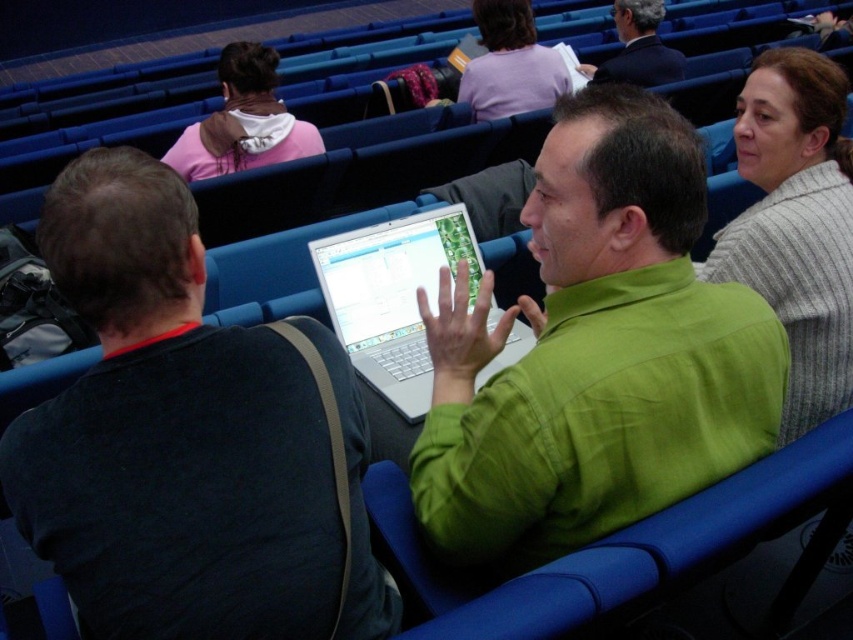
Question: Which object appears farthest from the camera in this image?

Choices:
 (A) pink fleece jacket at upper left
 (B) silver metallic laptop at center

Answer: (A)

Question: Considering the real-world distances, which object is closest to the dark gray suit at upper right?

Choices:
 (A) silver metallic laptop at center
 (B) pink fleece jacket at upper left
 (C) black matte laptop at left

Answer: (B)

Question: Does silver metallic laptop at center appear on the right side of dark gray suit at upper right?

Choices:
 (A) no
 (B) yes

Answer: (A)

Question: Is gray striped sweater at upper right bigger than dark gray suit at upper right?

Choices:
 (A) no
 (B) yes

Answer: (A)

Question: Is black matte laptop at left positioned before silver metallic laptop at center?

Choices:
 (A) yes
 (B) no

Answer: (A)

Question: Among these objects, which one is nearest to the camera?

Choices:
 (A) dark gray suit at upper right
 (B) green matte shirt at center
 (C) black matte laptop at left

Answer: (C)